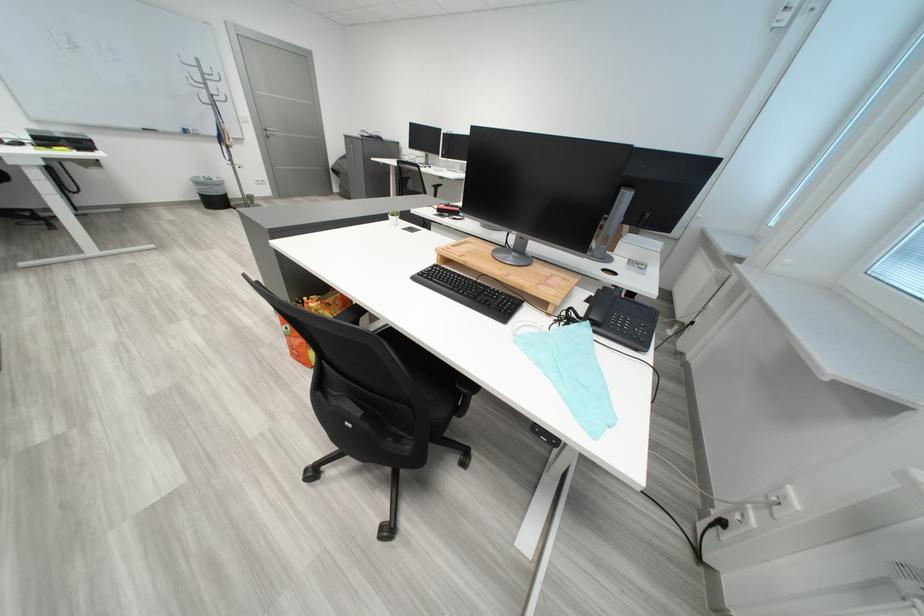
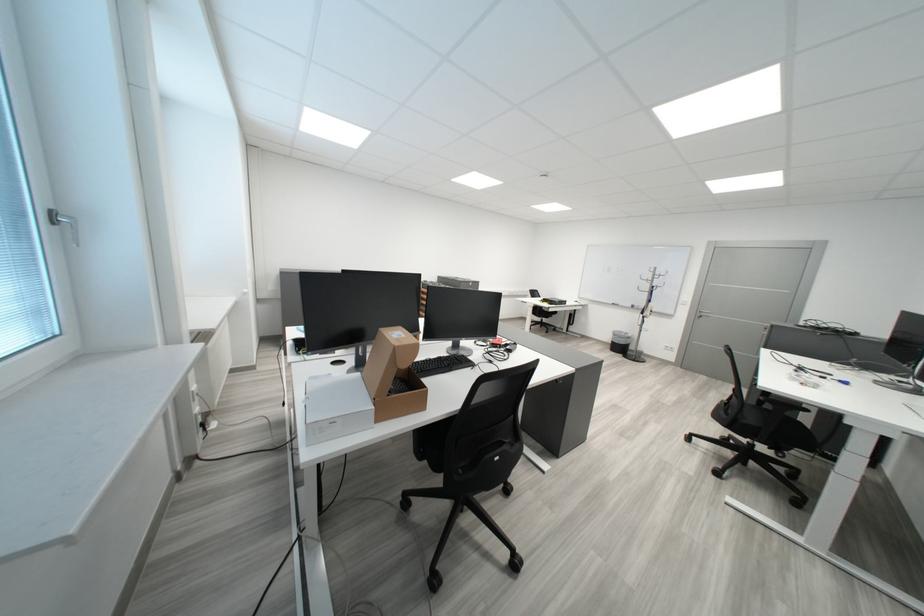
The point at [211,185] is marked in the first image. Where is the corresponding point in the second image?

(627, 336)